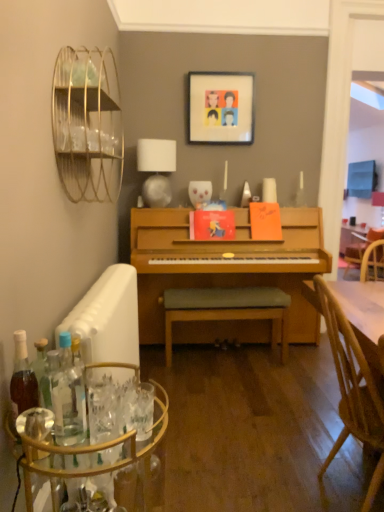
Question: Is light green fabric cushioned bench at center located within clear glass bottle at lower left, which ranks as the second bottle in left-to-right order?

Choices:
 (A) yes
 (B) no

Answer: (B)

Question: Considering the relative sizes of clear glass bottle at lower left, which ranks as the first bottle in right-to-left order, and light green fabric cushioned bench at center in the image provided, is clear glass bottle at lower left, which ranks as the first bottle in right-to-left order, taller than light green fabric cushioned bench at center?

Choices:
 (A) yes
 (B) no

Answer: (B)

Question: From a real-world perspective, is clear glass bottle at lower left, which ranks as the second bottle in left-to-right order, on top of light green fabric cushioned bench at center?

Choices:
 (A) yes
 (B) no

Answer: (A)

Question: Is clear glass bottle at lower left, which ranks as the second bottle in left-to-right order, not near light green fabric cushioned bench at center?

Choices:
 (A) yes
 (B) no

Answer: (A)

Question: Is clear glass bottle at lower left, which ranks as the first bottle in right-to-left order, oriented away from light green fabric cushioned bench at center?

Choices:
 (A) no
 (B) yes

Answer: (A)

Question: In terms of width, does matte plastic picture frame at upper center look wider or thinner when compared to clear glass bar cart at lower left?

Choices:
 (A) thin
 (B) wide

Answer: (A)

Question: Would you say matte plastic picture frame at upper center is to the left or to the right of clear glass bar cart at lower left in the picture?

Choices:
 (A) left
 (B) right

Answer: (B)

Question: Considering the positions of matte plastic picture frame at upper center and clear glass bar cart at lower left in the image, is matte plastic picture frame at upper center taller or shorter than clear glass bar cart at lower left?

Choices:
 (A) short
 (B) tall

Answer: (A)

Question: In terms of size, does matte plastic picture frame at upper center appear bigger or smaller than clear glass bar cart at lower left?

Choices:
 (A) small
 (B) big

Answer: (A)

Question: Considering the positions of point (64, 353) and point (201, 75), is point (64, 353) closer or farther from the camera than point (201, 75)?

Choices:
 (A) farther
 (B) closer

Answer: (B)

Question: Relative to matte plastic picture frame at upper center, is clear glass bottle at lower left, which ranks as the second bottle in left-to-right order, in front or behind?

Choices:
 (A) behind
 (B) front

Answer: (B)

Question: Is clear glass bottle at lower left, which ranks as the first bottle in right-to-left order, inside or outside of matte plastic picture frame at upper center?

Choices:
 (A) inside
 (B) outside

Answer: (B)

Question: Considering the relative positions of clear glass bottle at lower left, which ranks as the second bottle in left-to-right order, and matte plastic picture frame at upper center in the image provided, is clear glass bottle at lower left, which ranks as the second bottle in left-to-right order, to the left or to the right of matte plastic picture frame at upper center?

Choices:
 (A) right
 (B) left

Answer: (B)

Question: Looking at their shapes, would you say clear glass bar cart at lower left is wider or thinner than white fabric lampshade at upper center?

Choices:
 (A) wide
 (B) thin

Answer: (A)

Question: From the image's perspective, relative to white fabric lampshade at upper center, is clear glass bar cart at lower left above or below?

Choices:
 (A) below
 (B) above

Answer: (A)